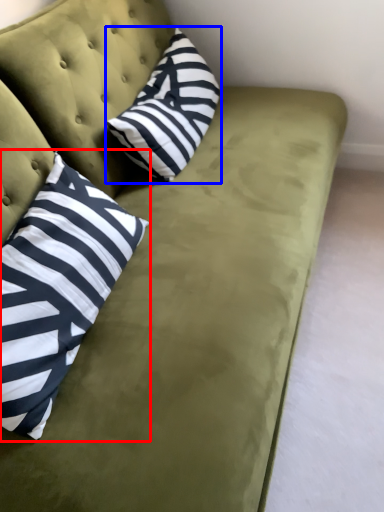
Question: Which point is closer to the camera, pillow (highlighted by a red box) or pillow (highlighted by a blue box)?

Choices:
 (A) pillow
 (B) pillow

Answer: (A)